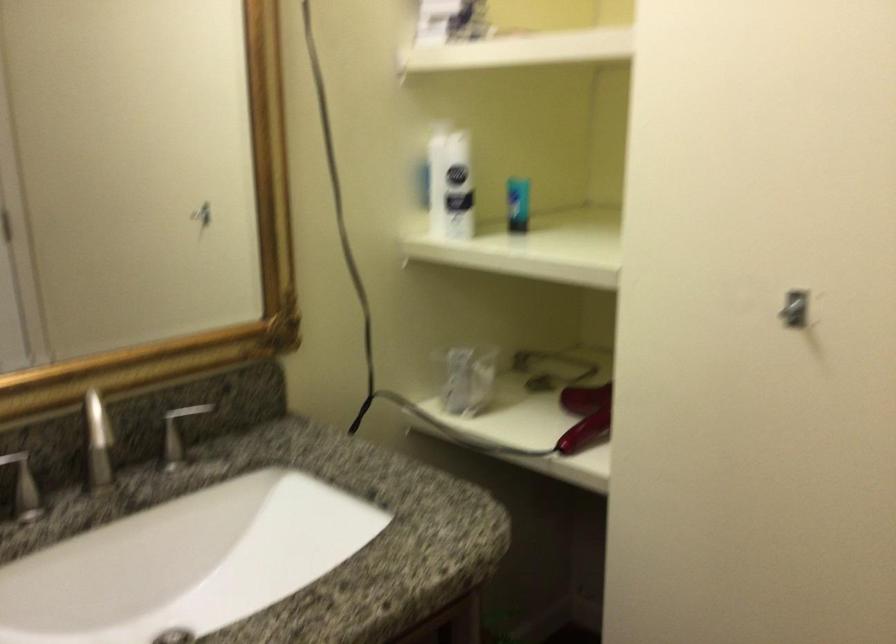
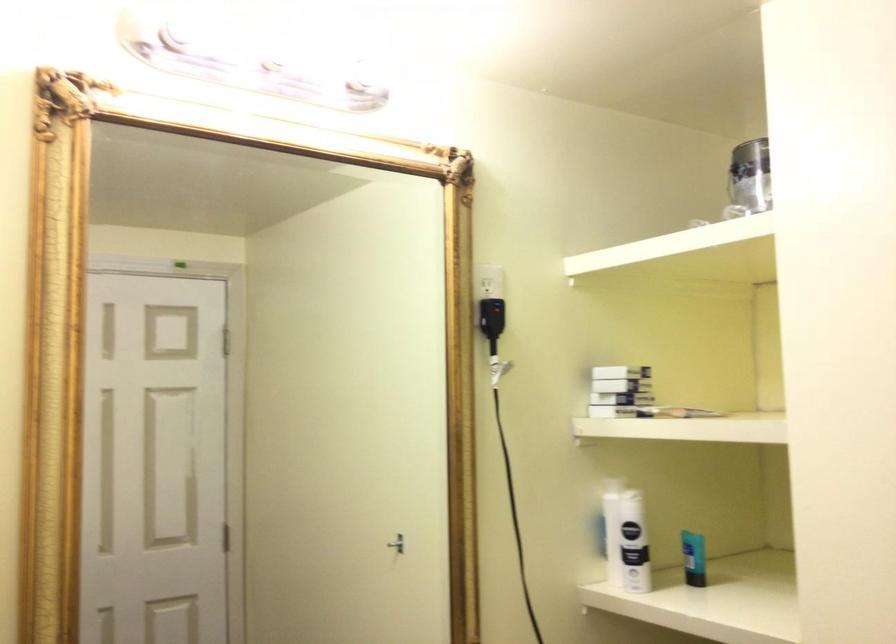
Question: In a continuous first-person perspective shot, in which direction is the camera moving?

Choices:
 (A) Left
 (B) Right
 (C) Forward
 (D) Backward

Answer: (D)